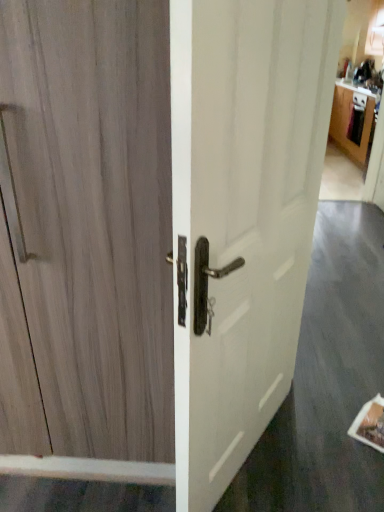
Question: Should I look upward or downward to see wooden cabinet at upper right?

Choices:
 (A) up
 (B) down

Answer: (A)

Question: Is wooden cabinet at upper right facing towards white glossy door handle at center?

Choices:
 (A) no
 (B) yes

Answer: (A)

Question: From a real-world perspective, does wooden cabinet at upper right sit lower than white glossy door handle at center?

Choices:
 (A) yes
 (B) no

Answer: (A)

Question: Can you confirm if wooden cabinet at upper right is positioned to the right of white glossy door handle at center?

Choices:
 (A) no
 (B) yes

Answer: (B)

Question: Is wooden cabinet at upper right taller than white glossy door handle at center?

Choices:
 (A) yes
 (B) no

Answer: (B)

Question: Is wooden cabinet at upper right positioned beyond the bounds of white glossy door handle at center?

Choices:
 (A) yes
 (B) no

Answer: (A)

Question: Considering the relative sizes of wooden cabinet at upper right and white glossy door handle at center in the image provided, is wooden cabinet at upper right bigger than white glossy door handle at center?

Choices:
 (A) yes
 (B) no

Answer: (A)

Question: Is light brown wood door at left located within wooden cabinet at upper right?

Choices:
 (A) yes
 (B) no

Answer: (B)

Question: Can you confirm if wooden cabinet at upper right is positioned to the left of light brown wood door at left?

Choices:
 (A) yes
 (B) no

Answer: (B)

Question: From the image's perspective, is wooden cabinet at upper right located above light brown wood door at left?

Choices:
 (A) yes
 (B) no

Answer: (A)

Question: Is wooden cabinet at upper right in front of light brown wood door at left?

Choices:
 (A) yes
 (B) no

Answer: (B)

Question: Does wooden cabinet at upper right have a greater height compared to light brown wood door at left?

Choices:
 (A) no
 (B) yes

Answer: (A)

Question: Considering the relative sizes of wooden cabinet at upper right and light brown wood door at left in the image provided, is wooden cabinet at upper right shorter than light brown wood door at left?

Choices:
 (A) yes
 (B) no

Answer: (A)

Question: Can you confirm if light brown wood door at left is smaller than wooden cabinet at upper right?

Choices:
 (A) no
 (B) yes

Answer: (B)